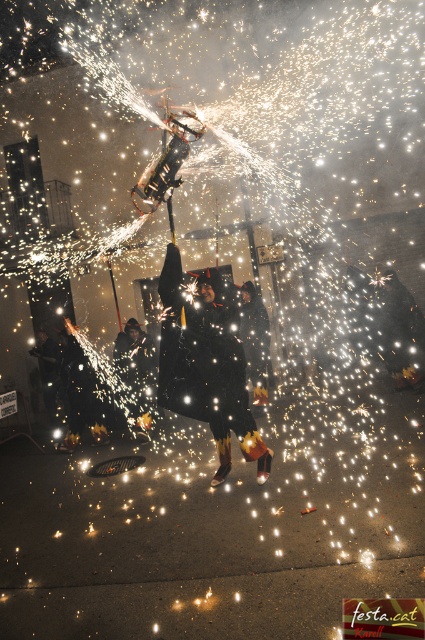
Question: Observing the image, what is the correct spatial positioning of black matte jacket at center in reference to shiny metallic helmet at center?

Choices:
 (A) left
 (B) right

Answer: (B)

Question: In this image, where is black matte jacket at center located relative to shiny metallic helmet at center?

Choices:
 (A) below
 (B) above

Answer: (B)

Question: Which point is farther to the camera?

Choices:
 (A) black matte coat at center
 (B) matte black jacket at lower left
 (C) black leather jacket at center

Answer: (B)

Question: Which object is closer to the camera taking this photo?

Choices:
 (A) shiny metallic helmet at center
 (B) matte black jacket at lower left

Answer: (A)

Question: From the image, what is the correct spatial relationship of black matte coat at center in relation to shiny metallic helmet at center?

Choices:
 (A) above
 (B) below

Answer: (A)

Question: Which point is closer to the camera?

Choices:
 (A) black matte coat at center
 (B) shiny metallic helmet at center
 (C) black leather jacket at center
 (D) matte black jacket at lower left

Answer: (A)